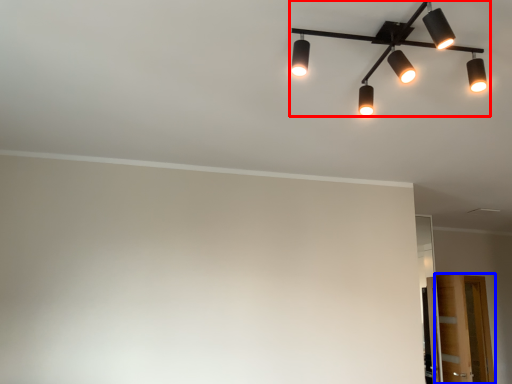
Question: Among these objects, which one is nearest to the camera, lamp (highlighted by a red box) or glass door (highlighted by a blue box)?

Choices:
 (A) lamp
 (B) glass door

Answer: (A)